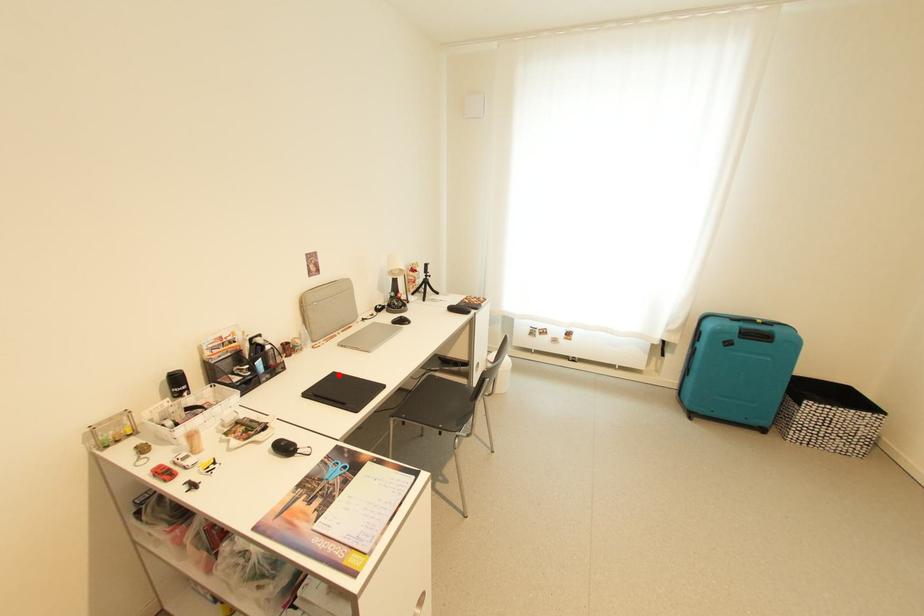
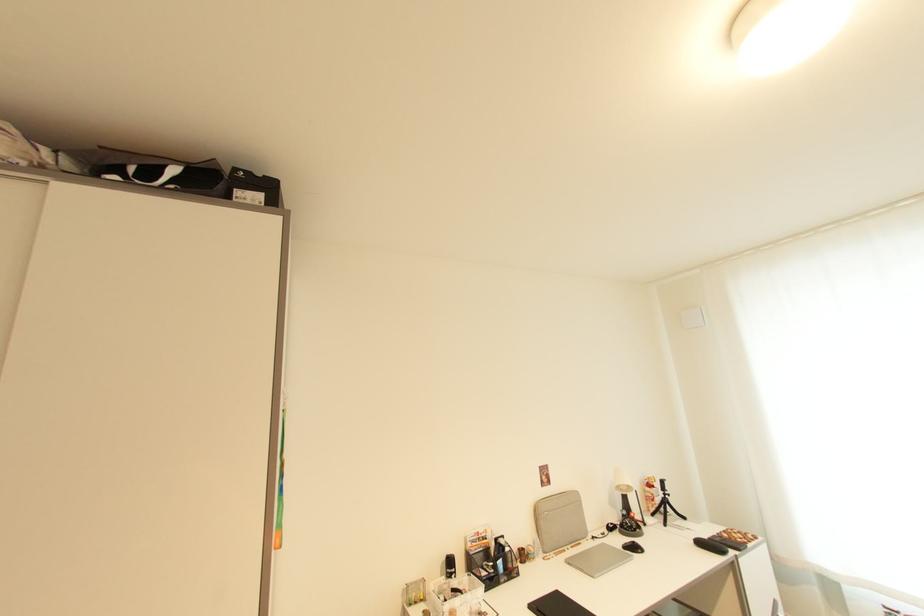
Question: I am providing you with two images of the same scene from different viewpoints. A red point is marked on the first image. Can you still see the location of the red point in image 2?

Choices:
 (A) Yes
 (B) No

Answer: (A)